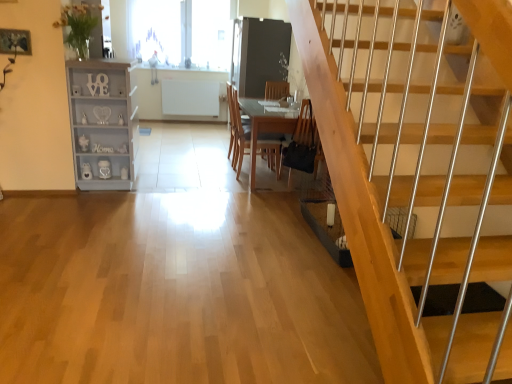
Question: Can you confirm if wooden chair at center is wider than transparent glass window at upper center, the 1th window in the front-to-back sequence?

Choices:
 (A) no
 (B) yes

Answer: (B)

Question: Considering the relative sizes of wooden chair at center and transparent glass window at upper center, which ranks as the second window in back-to-front order, in the image provided, is wooden chair at center bigger than transparent glass window at upper center, which ranks as the second window in back-to-front order,?

Choices:
 (A) no
 (B) yes

Answer: (B)

Question: From a real-world perspective, does wooden chair at center stand above transparent glass window at upper center, the 1th window in the front-to-back sequence?

Choices:
 (A) yes
 (B) no

Answer: (B)

Question: From the image's perspective, would you say wooden chair at center is shown under transparent glass window at upper center, which ranks as the second window in back-to-front order?

Choices:
 (A) no
 (B) yes

Answer: (B)

Question: Can you confirm if wooden chair at center is positioned to the right of transparent glass window at upper center, the 1th window in the front-to-back sequence?

Choices:
 (A) yes
 (B) no

Answer: (A)

Question: From the image's perspective, is transparent glass window at upper center, the second window viewed from the front, positioned above or below transparent glass window at upper center, which ranks as the second window in back-to-front order?

Choices:
 (A) above
 (B) below

Answer: (A)

Question: From a real-world perspective, relative to transparent glass window at upper center, which ranks as the second window in back-to-front order, is transparent glass window at upper center, positioned as the first window in back-to-front order, vertically above or below?

Choices:
 (A) above
 (B) below

Answer: (A)

Question: Is transparent glass window at upper center, the second window viewed from the front, inside or outside of transparent glass window at upper center, which ranks as the second window in back-to-front order?

Choices:
 (A) outside
 (B) inside

Answer: (A)

Question: Is transparent glass window at upper center, the second window viewed from the front, bigger or smaller than transparent glass window at upper center, which ranks as the second window in back-to-front order?

Choices:
 (A) small
 (B) big

Answer: (B)

Question: Is white painted wood shelf at left in front of or behind wooden table at center in the image?

Choices:
 (A) front
 (B) behind

Answer: (A)

Question: Would you say white painted wood shelf at left is to the left or to the right of wooden table at center in the picture?

Choices:
 (A) left
 (B) right

Answer: (A)

Question: From a real-world perspective, is white painted wood shelf at left above or below wooden table at center?

Choices:
 (A) above
 (B) below

Answer: (A)

Question: Looking at the image, does white painted wood shelf at left seem bigger or smaller compared to wooden table at center?

Choices:
 (A) big
 (B) small

Answer: (B)

Question: From the image's perspective, is black leather chair at lower center positioned above or below transparent glass window at upper center, the 1th window in the front-to-back sequence?

Choices:
 (A) below
 (B) above

Answer: (A)

Question: Is point (309, 104) closer or farther from the camera than point (175, 18)?

Choices:
 (A) farther
 (B) closer

Answer: (B)